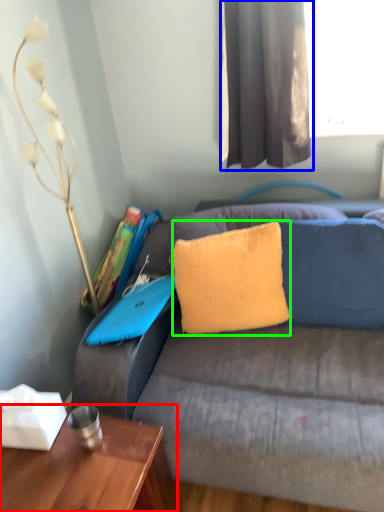
Question: Which object is positioned closest to table (highlighted by a red box)? Select from curtain (highlighted by a blue box) and pillow (highlighted by a green box).

Choices:
 (A) curtain
 (B) pillow

Answer: (B)